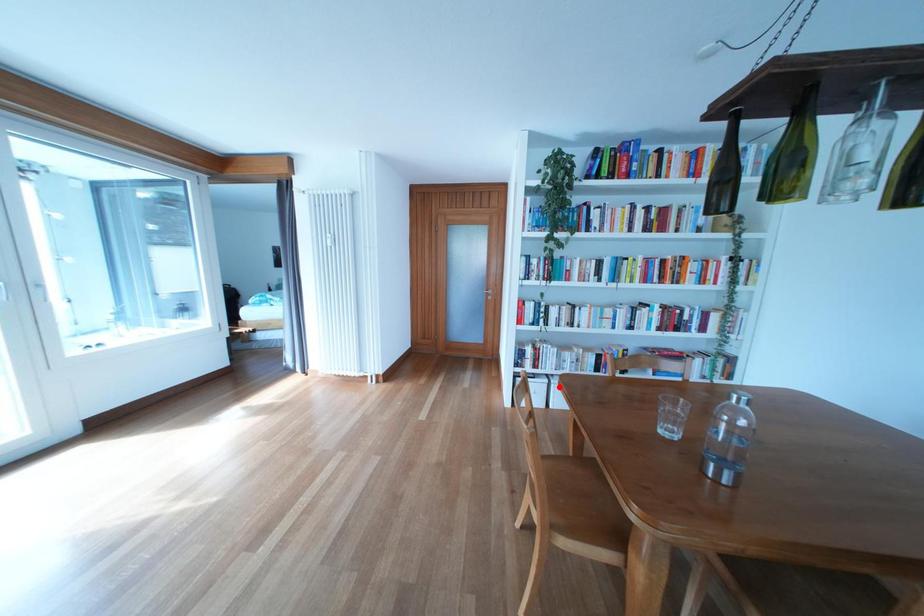
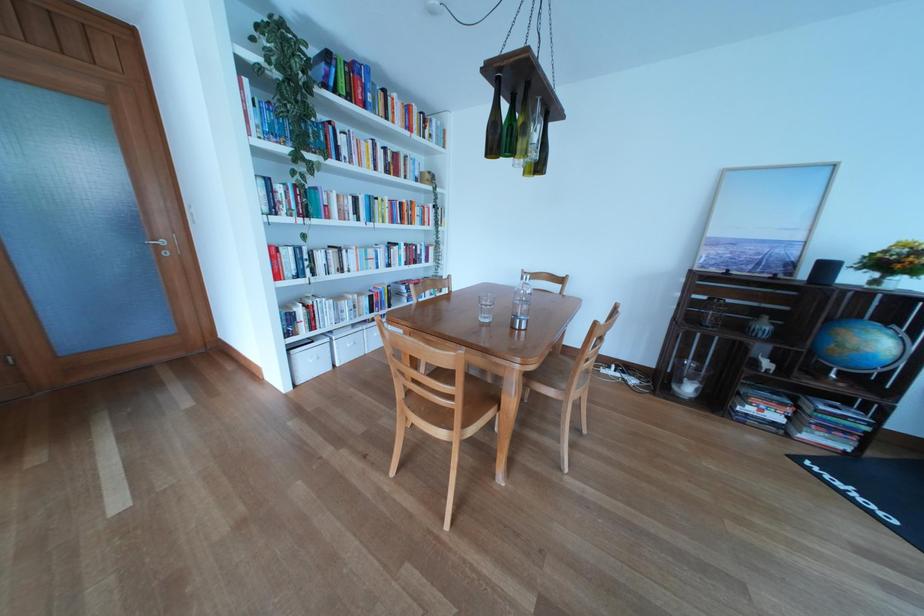
Question: I am providing you with two images of the same scene from different viewpoints. Given a red point in image1, look at the same physical point in image2. Is it:

Choices:
 (A) Closer to the viewpoint
 (B) Farther from the viewpoint

Answer: (A)